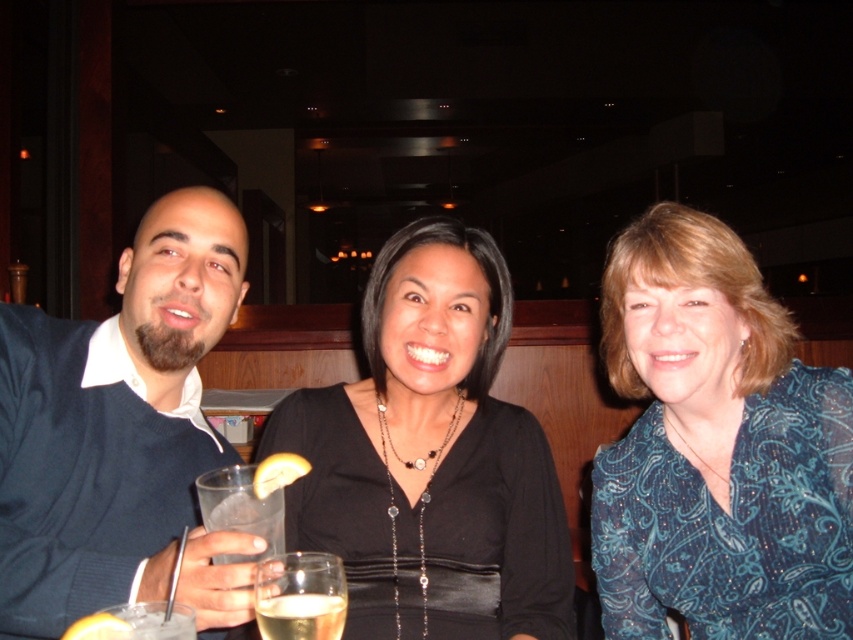
You are a photographer trying to capture a closeup shot of the black satin dress at center and the matte black dress at center. Your camera can only focus on objects within a 10 inch range. Can you fit both dresses into the frame without moving the camera?

The distance between the black satin dress at center and the matte black dress at center is 11.58 inches, which exceeds the camera focus range of 10 inches. Therefore, you cannot fit both dresses into the frame without moving the camera.

You are a bartender preparing drinks for the guests. You need to place a coaster under the yellow citrus peel at lower left and the matte black dress at center. Which one requires a larger coaster?

The matte black dress at center requires a larger coaster because its width is greater than the yellow citrus peel at lower left.